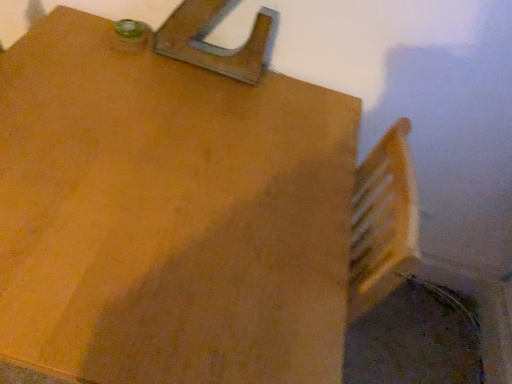
Find the location of `vacant area situated to the left side of wooden at upper center`. vacant area situated to the left side of wooden at upper center is located at coordinates (121, 52).